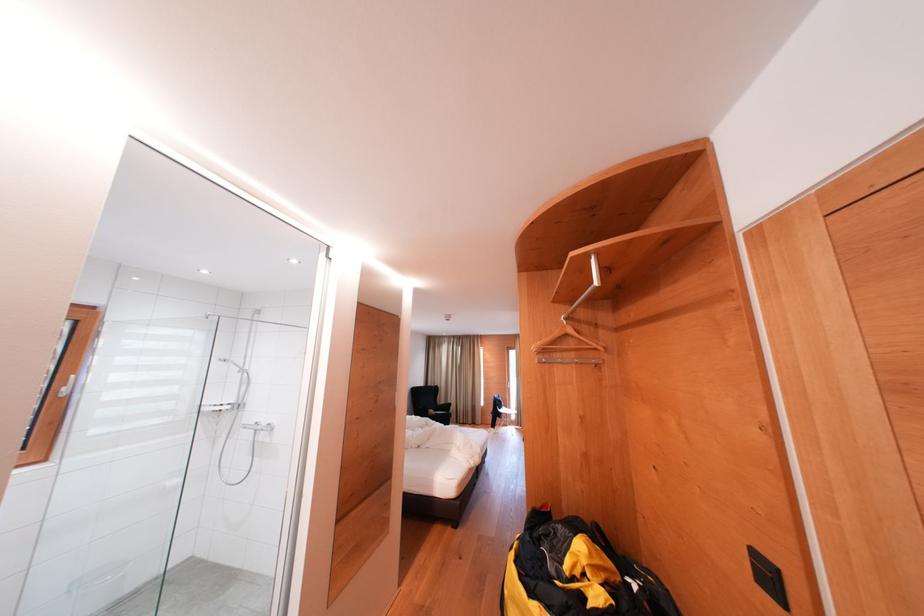
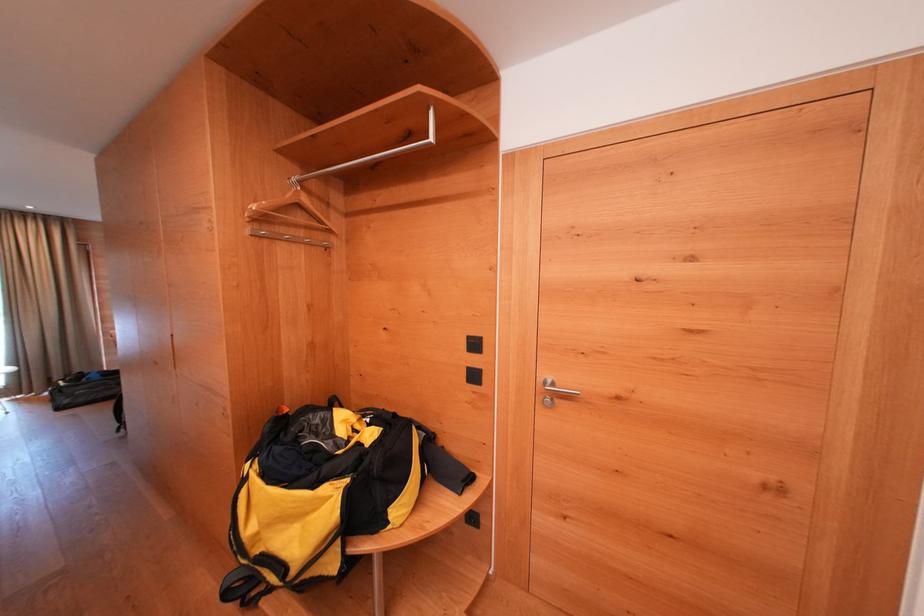
The point at (579, 359) is marked in the first image. Where is the corresponding point in the second image?

(308, 237)